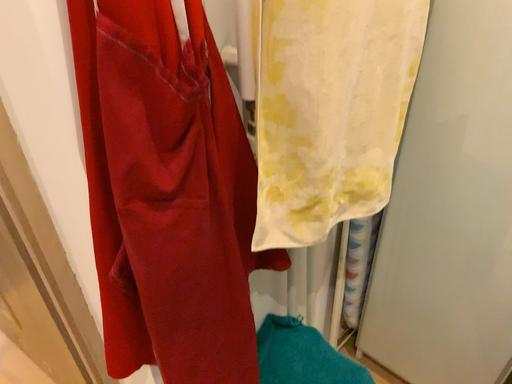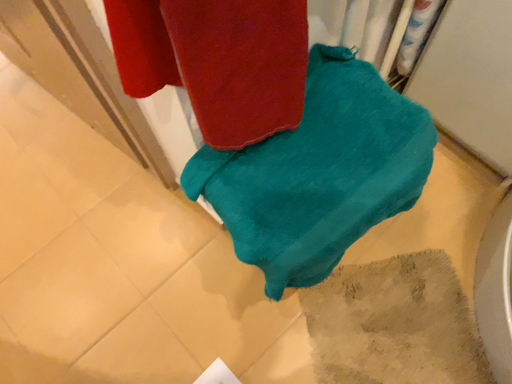
Question: How did the camera likely rotate when shooting the video?

Choices:
 (A) rotated upward
 (B) rotated downward

Answer: (B)